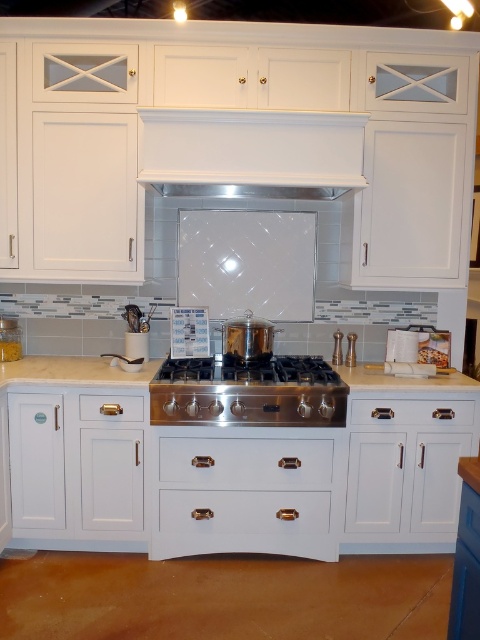
You are in the kitchen and need to adjust the exhaust hood. The stove is in use with a pot on it. Can you reach the white glossy exhaust hood at center from the stainless steel stove at center without moving the pot?

The white glossy exhaust hood at center is to the right of the stainless steel stove at center. Since it is positioned to the right, you can reach it without moving the pot by extending your arm sideways towards the right from the stove.